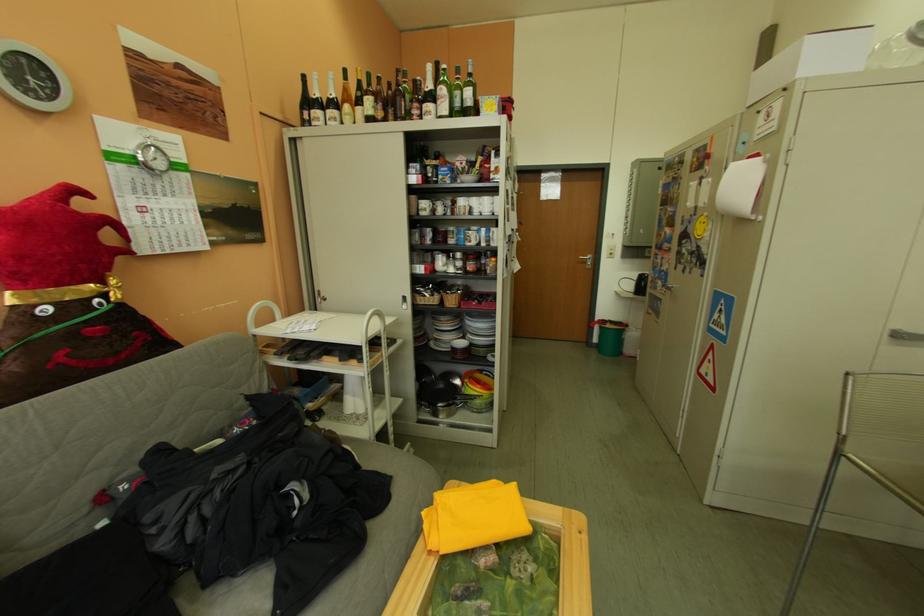
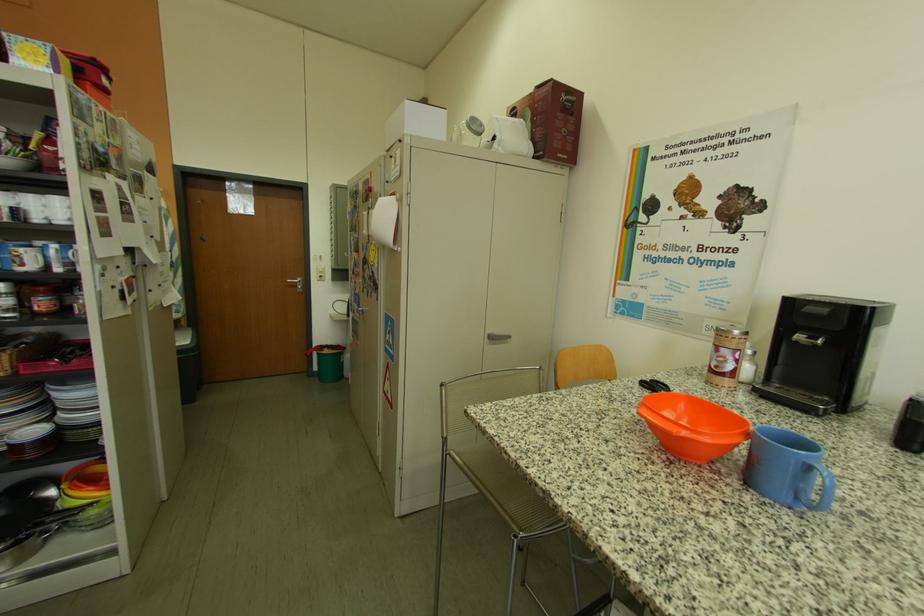
Question: The first image is from the beginning of the video and the second image is from the end. How did the camera likely rotate when shooting the video?

Choices:
 (A) Left
 (B) Right
 (C) Up
 (D) Down

Answer: (B)